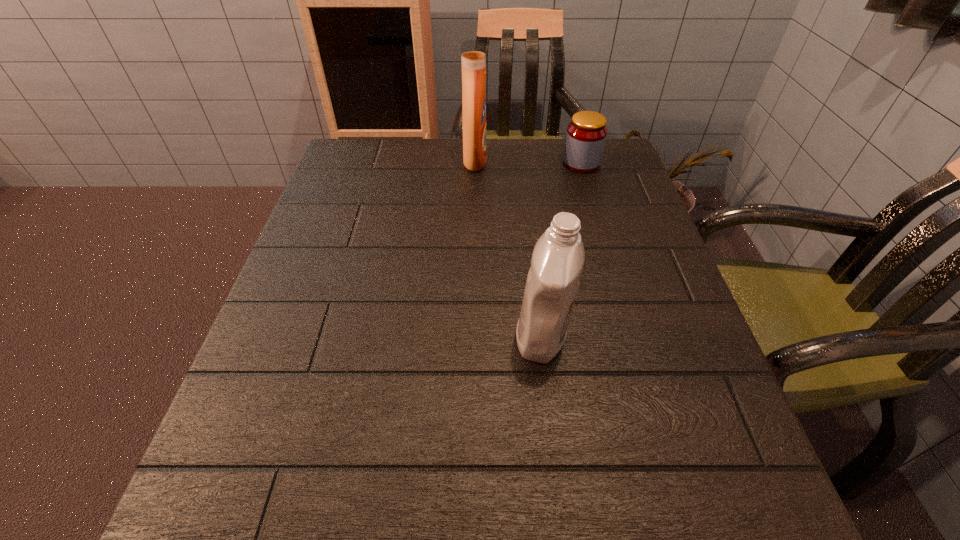
Where is `unoccupied position between the left detergent and the rightmost object`? This screenshot has height=540, width=960. unoccupied position between the left detergent and the rightmost object is located at coordinates (528, 162).

At what (x,y) coordinates should I click in order to perform the action: click on free point between the left detergent and the nearest object. Please return your answer as a coordinate pair (x, y). Looking at the image, I should click on pos(508,248).

Locate an element on the screen. Image resolution: width=960 pixels, height=540 pixels. free point between the rightmost object and the left detergent is located at coordinates (528, 162).

This screenshot has width=960, height=540. In order to click on vacant region between the rightmost object and the leftmost object in this screenshot , I will do point(528,162).

This screenshot has height=540, width=960. I want to click on free space that is in between the jar and the left detergent, so point(528,162).

Locate an element on the screen. This screenshot has height=540, width=960. vacant area between the shortest object and the farther detergent is located at coordinates (528, 162).

Locate which object is the closest to the left detergent. Please provide its 2D coordinates. Your answer should be formatted as a tuple, i.e. [(x, y)], where the tuple contains the x and y coordinates of a point satisfying the conditions above.

[(586, 134)]

Locate which object ranks second in proximity to the left detergent. Please provide its 2D coordinates. Your answer should be formatted as a tuple, i.e. [(x, y)], where the tuple contains the x and y coordinates of a point satisfying the conditions above.

[(557, 261)]

Locate an element on the screen. The width and height of the screenshot is (960, 540). vacant area in the image that satisfies the following two spatial constraints: 1. on the back side of the second object from right to left; 2. on the left side of the rightmost object is located at coordinates (520, 164).

Locate an element on the screen. vacant region that satisfies the following two spatial constraints: 1. on the back side of the nearer detergent; 2. on the front-facing side of the left detergent is located at coordinates (520, 161).